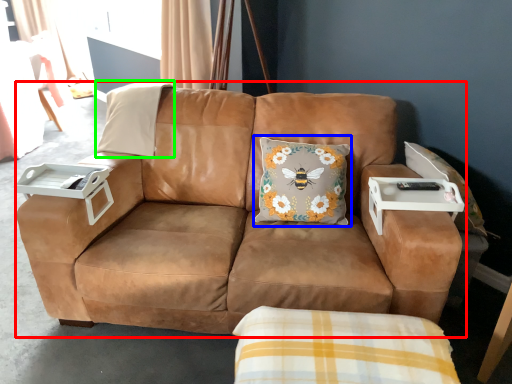
Question: Which object is the farthest from studio couch (highlighted by a red box)? Choose among these: throw pillow (highlighted by a blue box) or pillow (highlighted by a green box).

Choices:
 (A) throw pillow
 (B) pillow

Answer: (B)